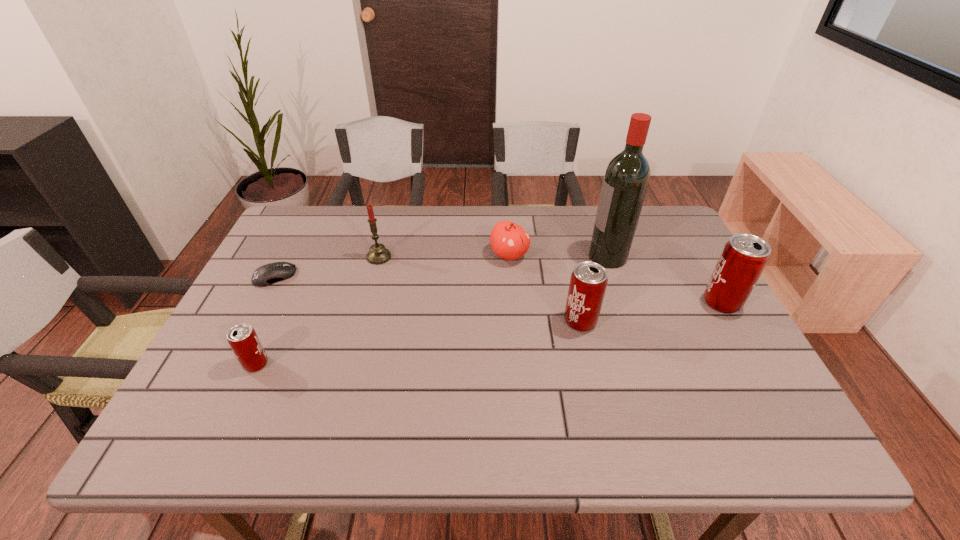
Find the location of a particular element. location for an additional beer_can to make spacing equal is located at coordinates (425, 342).